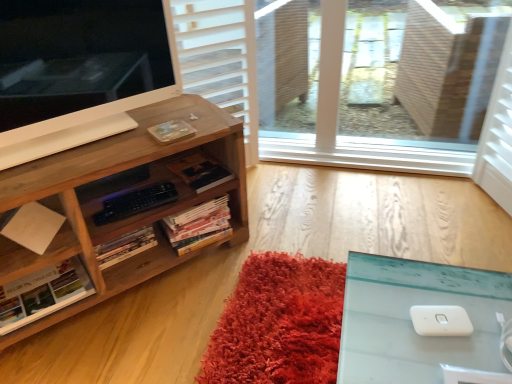
Question: Is hardcover book at center, positioned as the 2th book in left-to-right order, to the right of hardcover book at center, the fourth book positioned from the left, from the viewer's perspective?

Choices:
 (A) yes
 (B) no

Answer: (B)

Question: Could you tell me if hardcover book at center, positioned as the 2th book in left-to-right order, is turned towards hardcover book at center, the fourth book positioned from the left?

Choices:
 (A) yes
 (B) no

Answer: (B)

Question: Is hardcover book at center, the fourth book positioned from the left, inside hardcover book at center, positioned as the 2th book in left-to-right order?

Choices:
 (A) no
 (B) yes

Answer: (A)

Question: Is hardcover book at center, the 3th book viewed from the right, positioned behind hardcover book at center, the fourth book positioned from the left?

Choices:
 (A) yes
 (B) no

Answer: (B)

Question: From the image's perspective, is hardcover book at center, positioned as the 2th book in left-to-right order, on hardcover book at center, the first book from the right?

Choices:
 (A) no
 (B) yes

Answer: (A)

Question: Is point (133, 124) closer or farther from the camera than point (181, 248)?

Choices:
 (A) closer
 (B) farther

Answer: (A)

Question: From their relative heights in the image, would you say white glossy computer monitor at upper left is taller or shorter than hardcover books at center, which is the 3th book from left to right?

Choices:
 (A) short
 (B) tall

Answer: (B)

Question: Relative to hardcover books at center, which is the 3th book from left to right, is white glossy computer monitor at upper left in front or behind?

Choices:
 (A) front
 (B) behind

Answer: (A)

Question: Looking at their shapes, would you say white glossy computer monitor at upper left is wider or thinner than hardcover books at center, the second book from the right?

Choices:
 (A) thin
 (B) wide

Answer: (A)

Question: From the image's perspective, relative to hardcover book at center, the fourth book positioned from the left, is white matte paper at lower left above or below?

Choices:
 (A) below
 (B) above

Answer: (A)

Question: From a real-world perspective, relative to hardcover book at center, the first book from the right, is white matte paper at lower left vertically above or below?

Choices:
 (A) below
 (B) above

Answer: (B)

Question: Is white matte paper at lower left taller or shorter than hardcover book at center, the first book from the right?

Choices:
 (A) short
 (B) tall

Answer: (B)

Question: Looking at the image, does white matte paper at lower left seem bigger or smaller compared to hardcover book at center, the first book from the right?

Choices:
 (A) small
 (B) big

Answer: (B)

Question: From their relative heights in the image, would you say hardcover book at center, the first book from the right, is taller or shorter than white glossy computer monitor at upper left?

Choices:
 (A) short
 (B) tall

Answer: (A)

Question: In terms of width, does hardcover book at center, the fourth book positioned from the left, look wider or thinner when compared to white glossy computer monitor at upper left?

Choices:
 (A) thin
 (B) wide

Answer: (B)